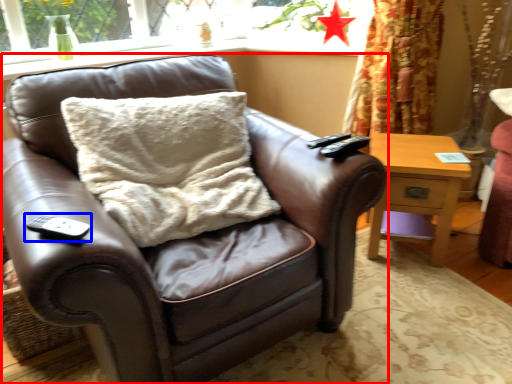
Question: Among these objects, which one is nearest to the camera, chair (highlighted by a red box) or remote (highlighted by a blue box)?

Choices:
 (A) chair
 (B) remote

Answer: (A)